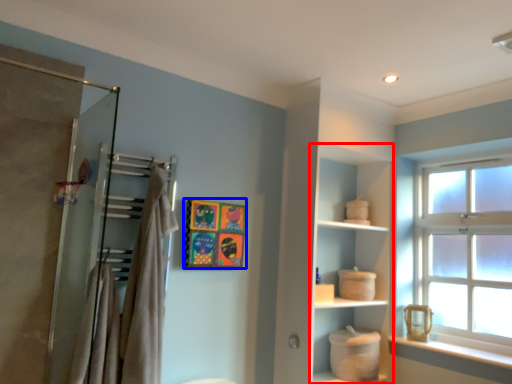
Question: Among these objects, which one is farthest to the camera, cabinet (highlighted by a red box) or picture frame (highlighted by a blue box)?

Choices:
 (A) cabinet
 (B) picture frame

Answer: (A)